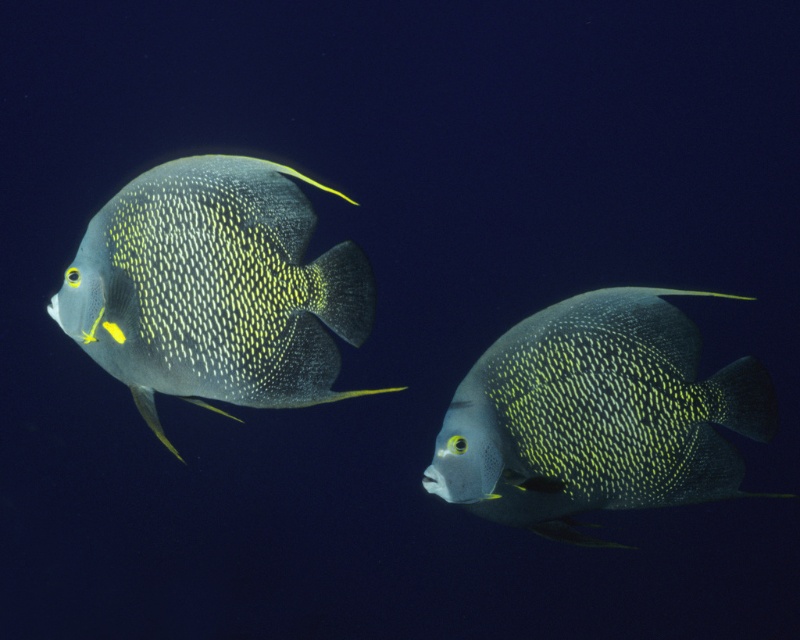
Does shiny blue fish at left lie behind shiny blue fish at center?

No, it is not.

Which is more to the left, shiny blue fish at left or shiny blue fish at center?

Positioned to the left is shiny blue fish at left.

Is point (121, 344) more distant than point (592, 396)?

Yes, point (121, 344) is behind point (592, 396).

This screenshot has height=640, width=800. Identify the location of shiny blue fish at left. (216, 289).